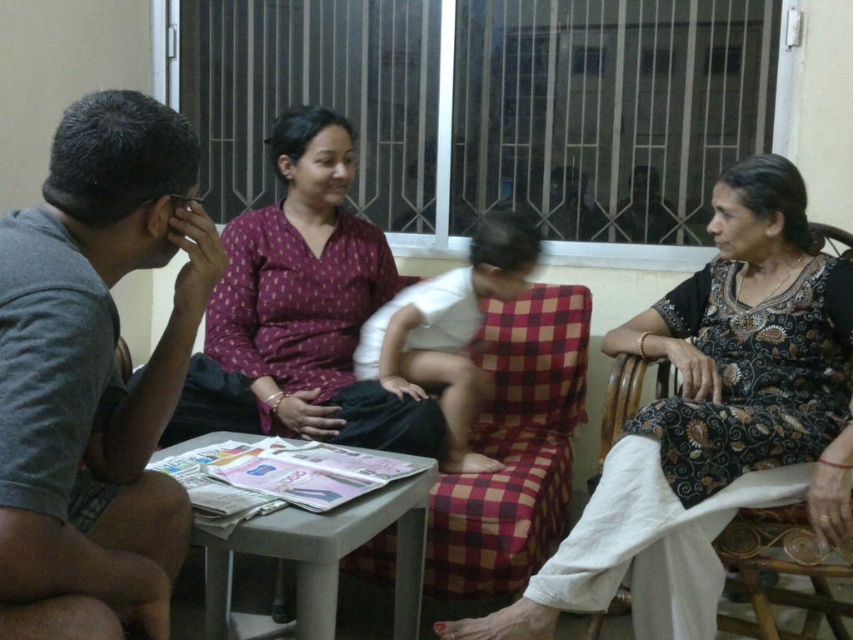
Question: Which object is the closest to the black printed dress at center?

Choices:
 (A) plaid fabric armchair at center
 (B) gray cotton shirt at left
 (C) white cotton baby at center

Answer: (A)

Question: Which point appears farthest from the camera in this image?

Choices:
 (A) (207, 544)
 (B) (560, 401)

Answer: (B)

Question: Is black printed dress at center thinner than white plastic table at center?

Choices:
 (A) no
 (B) yes

Answer: (A)

Question: Can you confirm if plaid fabric armchair at center is positioned below white plastic table at center?

Choices:
 (A) no
 (B) yes

Answer: (A)

Question: Which of these objects is positioned farthest from the plaid fabric armchair at center?

Choices:
 (A) black printed dress at center
 (B) gray cotton shirt at left

Answer: (B)

Question: Can you confirm if black printed dress at center is wider than white plastic table at center?

Choices:
 (A) no
 (B) yes

Answer: (B)